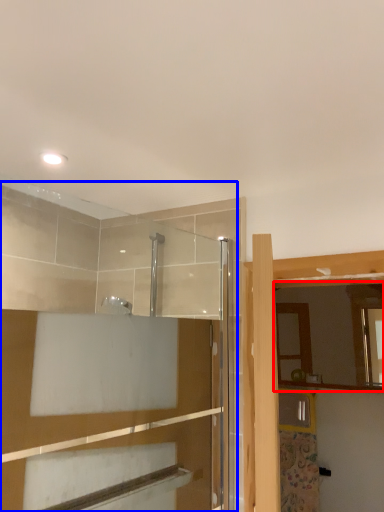
Question: Among these objects, which one is nearest to the camera, mirror (highlighted by a red box) or screen door (highlighted by a blue box)?

Choices:
 (A) mirror
 (B) screen door

Answer: (B)